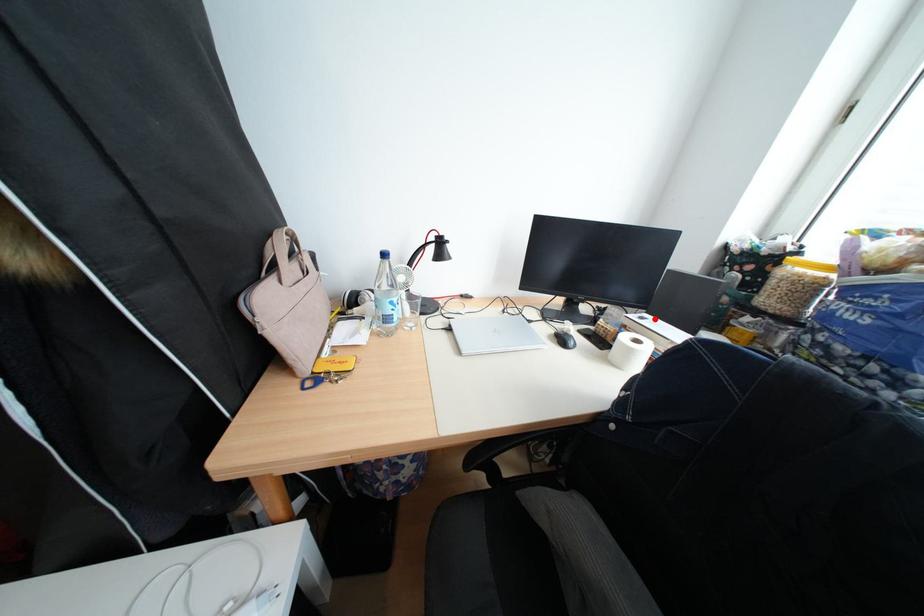
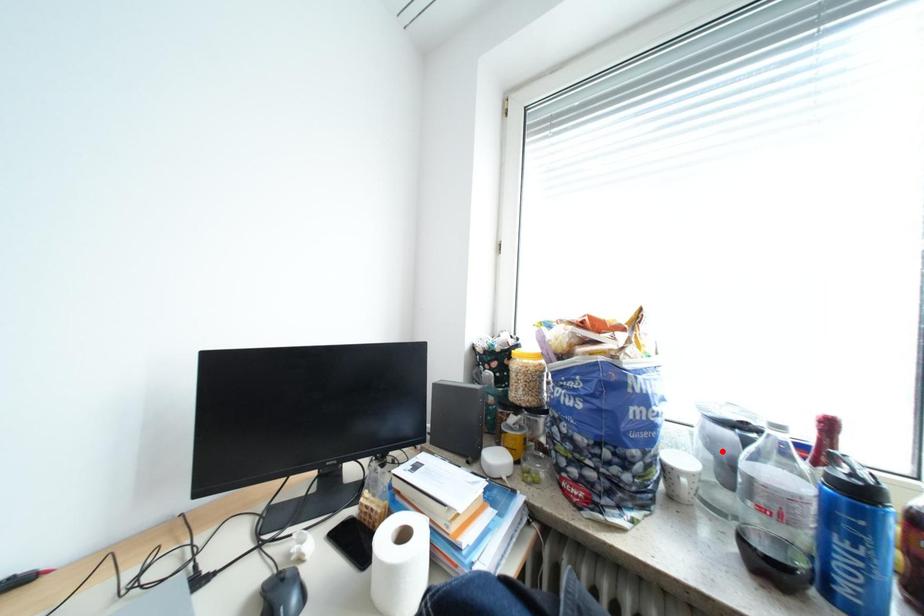
I am providing you with two images of the same scene from different viewpoints. A red point is marked on the first image and another point is marked on the second image. Does the point marked in image1 correspond to the same location as the one in image2?

No